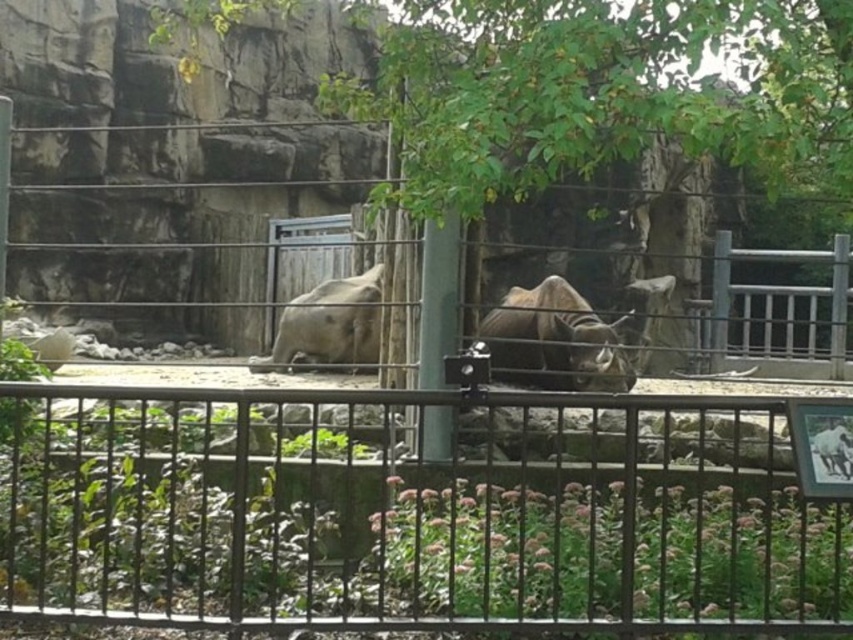
You are a zookeeper who needs to approach the metallic black fence at center to feed the camels. If your reach extends 1.5 meters, can you feed them without crossing the fence?

The metallic black fence at center is 3.49 meters away from the viewer. Since your reach is only 1.5 meters, you cannot feed the camels without crossing the fence.

You are a zookeeper checking the enclosure layout. You notice the green leafy tree at upper center and the brown textured rhino at center. Which object is positioned higher in the image?

The green leafy tree at upper center is located above the brown textured rhino at center, so it is positioned higher in the image.

You are a zookeeper trying to determine if the metallic black fence at center can fit through a gate that is 2 meters wide. Given that the brown textured rhino at center is 1.5 meters wide, can the fence pass through the gate?

Answer: The metallic black fence at center might be wider than the brown textured rhino at center which is 1.5 meters wide. Therefore, the fence might not fit through the 2 meter wide gate if it is wider than 2 meters.